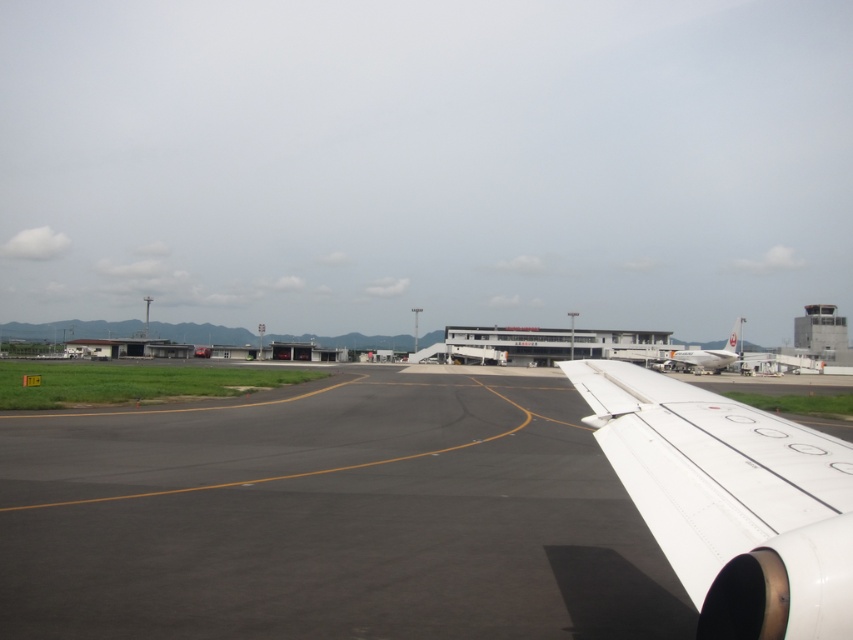
Question: Does black asphalt tarmac at center appear under white matte wing at right?

Choices:
 (A) no
 (B) yes

Answer: (A)

Question: Can you confirm if white matte wing at right is positioned below white glossy airplane at right?

Choices:
 (A) no
 (B) yes

Answer: (B)

Question: Which point is farther from the camera taking this photo?

Choices:
 (A) (611, 385)
 (B) (781, 573)

Answer: (A)

Question: Considering the real-world distances, which object is farthest from the white matte wing at right?

Choices:
 (A) black asphalt tarmac at center
 (B) white glossy airplane at right

Answer: (B)

Question: Can you confirm if black asphalt tarmac at center is positioned to the right of white glossy airplane at right?

Choices:
 (A) yes
 (B) no

Answer: (B)

Question: Which object is positioned closest to the black asphalt tarmac at center?

Choices:
 (A) white glossy airplane at right
 (B) white matte wing at right

Answer: (B)